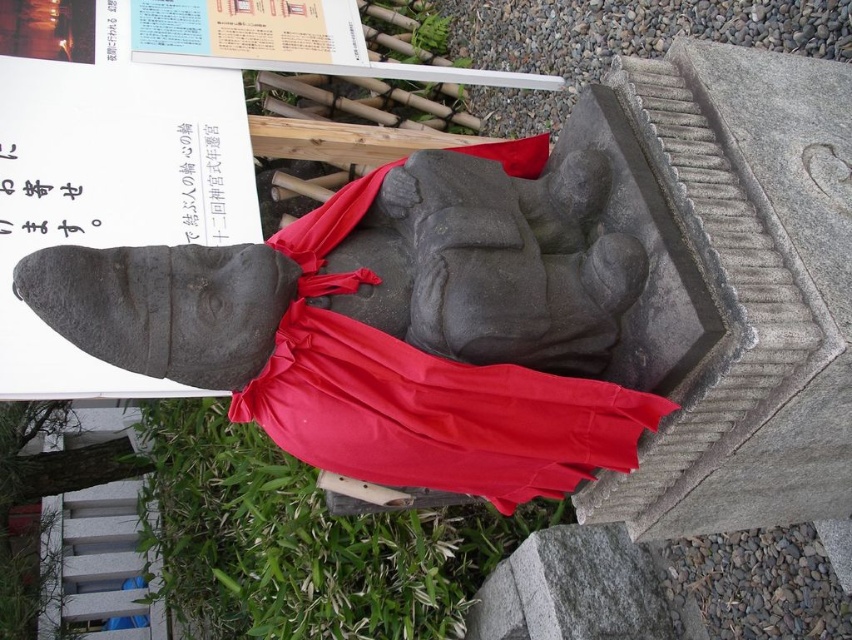
Question: Does black paper at upper left have a smaller size compared to black paper at upper center?

Choices:
 (A) no
 (B) yes

Answer: (B)

Question: Is red fabric at center above black paper at upper left?

Choices:
 (A) yes
 (B) no

Answer: (B)

Question: Which point appears closest to the camera in this image?

Choices:
 (A) (42, 227)
 (B) (213, 200)

Answer: (A)

Question: Which point appears farthest from the camera in this image?

Choices:
 (A) (204, 173)
 (B) (60, 147)
 (C) (579, 397)

Answer: (A)

Question: Does black paper at upper left have a greater width compared to black paper at upper center?

Choices:
 (A) yes
 (B) no

Answer: (A)

Question: Which of the following is the closest to the observer?

Choices:
 (A) (536, 460)
 (B) (93, 224)

Answer: (A)